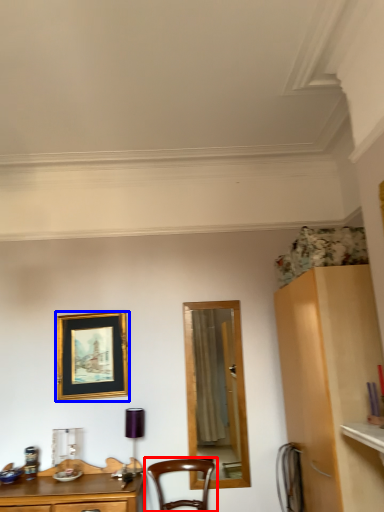
Question: Which point is closer to the camera, chair (highlighted by a red box) or picture frame (highlighted by a blue box)?

Choices:
 (A) chair
 (B) picture frame

Answer: (A)